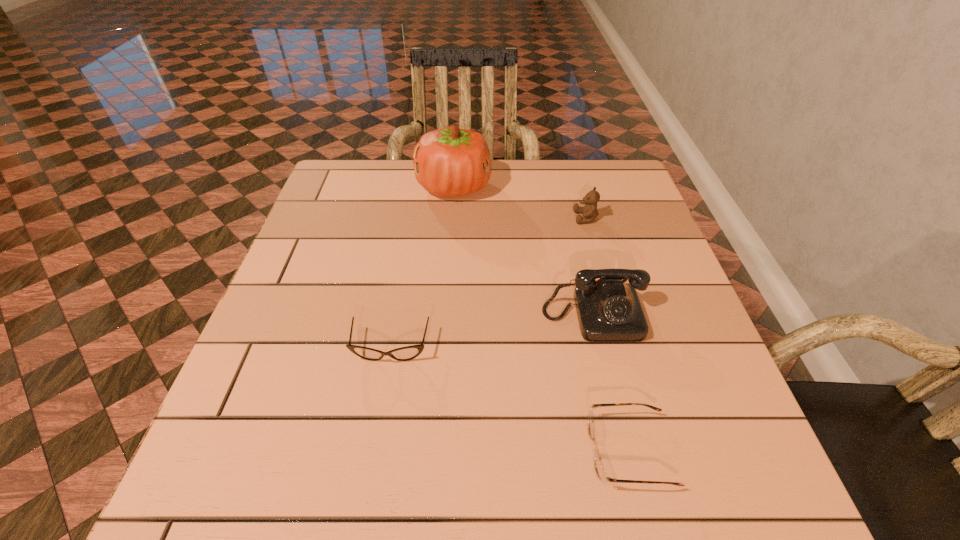
Identify the location of the farthest object. (448, 162).

Locate an element on the screen. pumpkin is located at coordinates (448, 162).

The image size is (960, 540). What are the coordinates of `the second tallest object` in the screenshot? It's located at tap(608, 310).

You are a GUI agent. You are given a task and a screenshot of the screen. Output one action in this format:
    pyautogui.click(x=<x>, y=<y>)
    Task: Click on the teddy bear
    The image size is (960, 540).
    Given the screenshot: What is the action you would take?
    pyautogui.click(x=589, y=211)

The image size is (960, 540). Find the location of `the third tallest object`. the third tallest object is located at coordinates (589, 211).

Find the location of a particular element. This screenshot has height=540, width=960. the taller spectacles is located at coordinates (407, 353).

Where is `the second shortest object`? the second shortest object is located at coordinates (407, 353).

The image size is (960, 540). I want to click on the right spectacles, so click(599, 468).

You are a GUI agent. You are given a task and a screenshot of the screen. Output one action in this format:
    pyautogui.click(x=<x>, y=<y>)
    Task: Click on the shorter spectacles
    
    Given the screenshot: What is the action you would take?
    pyautogui.click(x=599, y=468)

I want to click on free spot located on the side of the tallest object with the cute face, so click(525, 186).